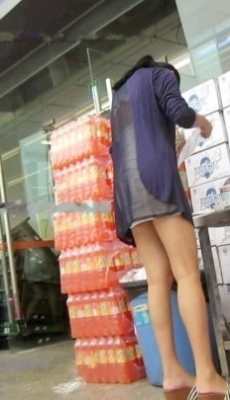
Where is `frame`? frame is located at coordinates (200, 223), (222, 348), (222, 368).